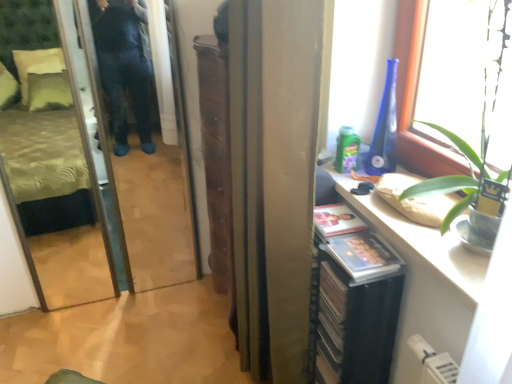
Where is `free space underneath transparent glass screen door at left (from a real-world perspective)`? Image resolution: width=512 pixels, height=384 pixels. free space underneath transparent glass screen door at left (from a real-world perspective) is located at coordinates (134, 296).